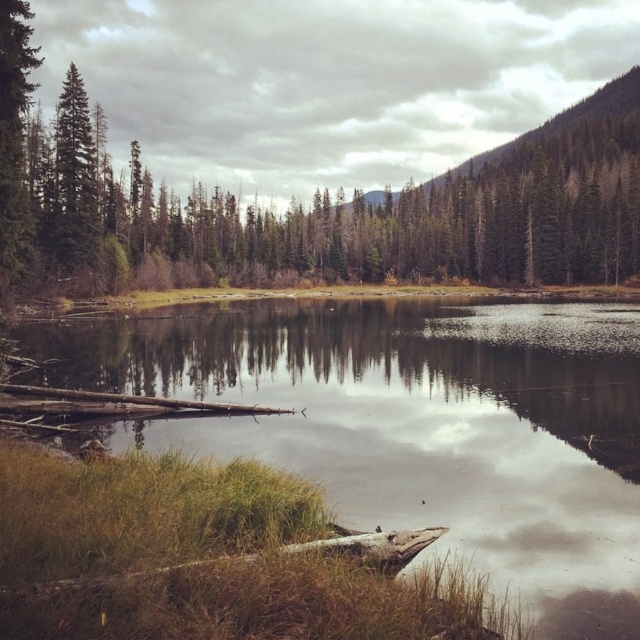
You are a hiker who wants to cross the lake. You have a small boat that can travel 100 meters. Based on the scene, can you safely reach the green matte tree at center using your boat from the smooth reflective water at center?

The distance between the smooth reflective water at center and the green matte tree at center is 103.34 meters. Since your boat can only travel 100 meters, you cannot safely reach the green matte tree at center.